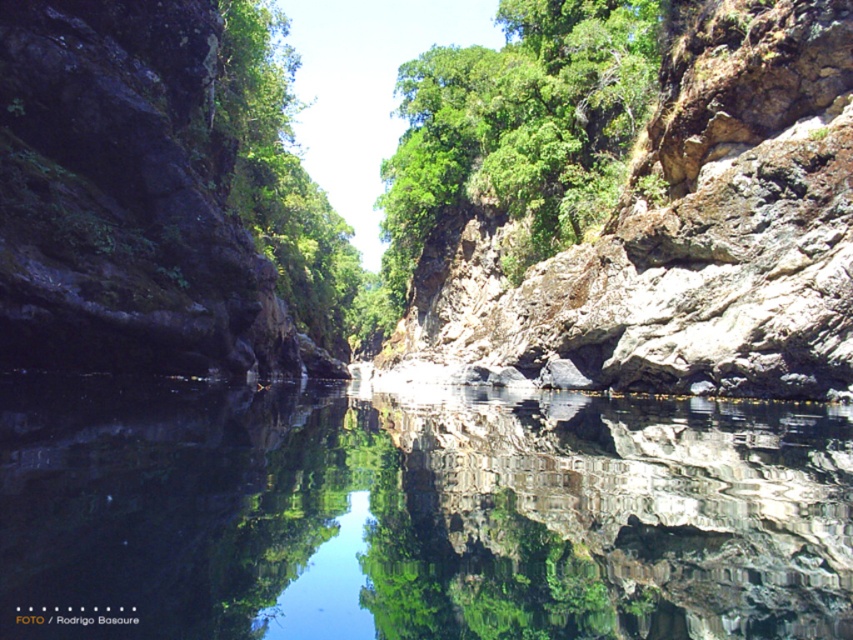
Which is more to the left, clear water at center or green leafy tree at center?

green leafy tree at center

Who is more distant from viewer, (509, 413) or (247, 148)?

Point (247, 148)

Locate an element on the screen. This screenshot has height=640, width=853. clear water at center is located at coordinates (416, 513).

What are the coordinates of `clear water at center` in the screenshot? It's located at (416, 513).

Between point (799, 10) and point (283, 243), which one is positioned in front?

Positioned in front is point (799, 10).

Does rough rock cliff at upper right have a larger size compared to green leafy tree at center?

Incorrect, rough rock cliff at upper right is not larger than green leafy tree at center.

Is point (831, 177) farther from viewer compared to point (277, 102)?

No, (831, 177) is closer to viewer.

You are a GUI agent. You are given a task and a screenshot of the screen. Output one action in this format:
    pyautogui.click(x=<x>, y=<y>)
    Task: Click on the rough rock cliff at upper right
    This screenshot has height=640, width=853.
    Given the screenshot: What is the action you would take?
    pyautogui.click(x=682, y=236)

From the picture: Between clear water at center and rough rock cliff at upper right, which one is positioned lower?

Positioned lower is clear water at center.

Does point (624, 605) come closer to viewer compared to point (689, 368)?

Yes, point (624, 605) is in front of point (689, 368).

This screenshot has width=853, height=640. I want to click on clear water at center, so click(416, 513).